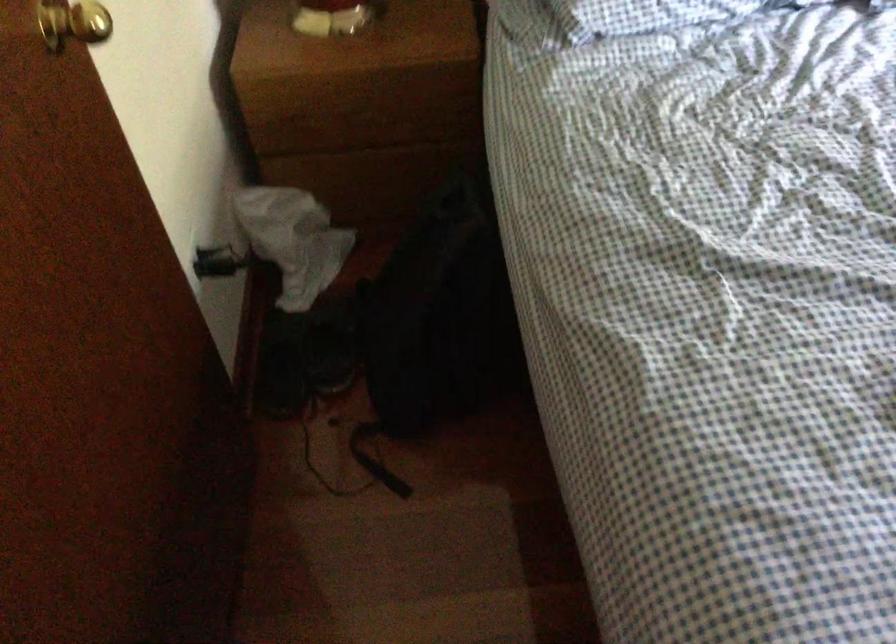
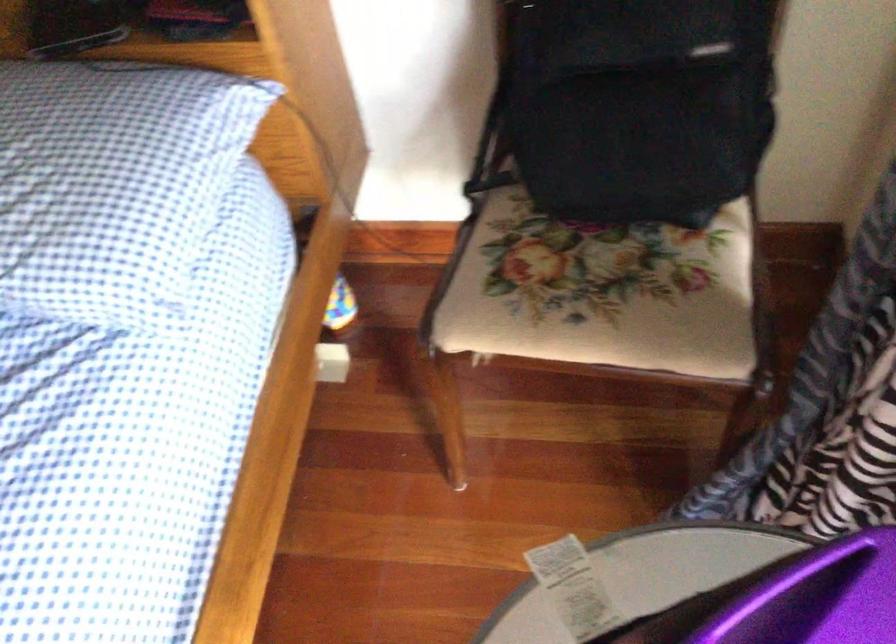
Question: What movement of the cameraman would produce the second image?

Choices:
 (A) Left
 (B) Right
 (C) Forward
 (D) Backward

Answer: (B)